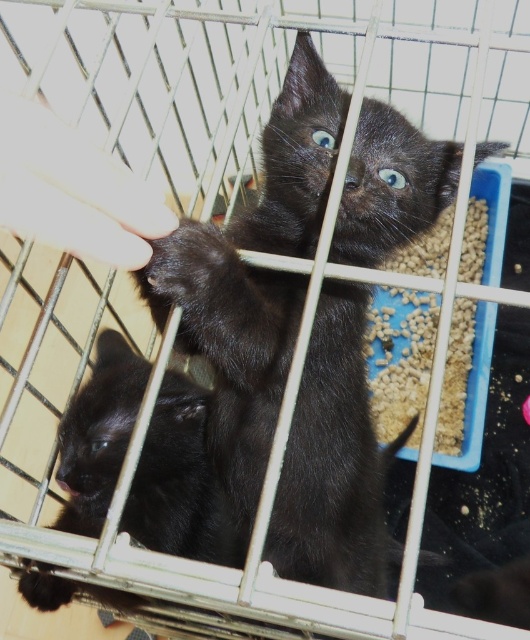
Consider the image. Who is positioned more to the left, shiny black kitten at center or shiny black kitten at lower left?

shiny black kitten at lower left

Is point (197, 352) positioned in front of point (205, 556)?

Yes, it is.

You are a GUI agent. You are given a task and a screenshot of the screen. Output one action in this format:
    pyautogui.click(x=<x>, y=<y>)
    Task: Click on the shiny black kitten at center
    
    Given the screenshot: What is the action you would take?
    pyautogui.click(x=253, y=276)

Locate an element on the screen. The image size is (530, 640). shiny black kitten at center is located at coordinates (253, 276).

Which is behind, point (33, 595) or point (85, 172)?

Point (33, 595)

In the scene shown: Which of these two, shiny black kitten at lower left or smooth skin hand at upper left, stands shorter?

smooth skin hand at upper left is shorter.

Between point (180, 419) and point (117, 172), which one is positioned behind?

The point (180, 419) is more distant.

Identify the location of shiny black kitten at lower left. (180, 481).